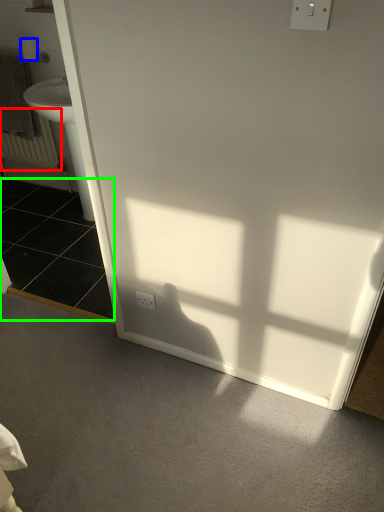
Question: Which is nearer to the radiator (highlighted by a red box)? toilet paper (highlighted by a blue box) or tile (highlighted by a green box).

Choices:
 (A) toilet paper
 (B) tile

Answer: (B)